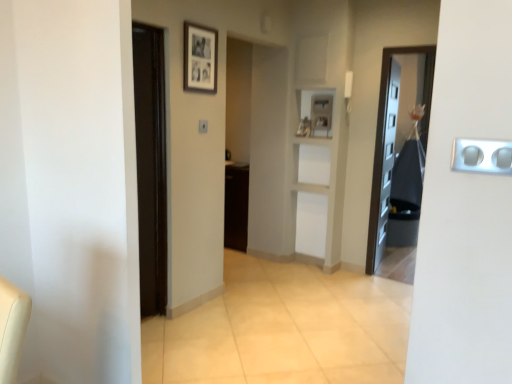
Question: Is black fabric bag at right taller than silver metallic outlet at right?

Choices:
 (A) yes
 (B) no

Answer: (A)

Question: Is black fabric bag at right thinner than silver metallic outlet at right?

Choices:
 (A) no
 (B) yes

Answer: (A)

Question: Could you tell me if black fabric bag at right is turned towards silver metallic outlet at right?

Choices:
 (A) yes
 (B) no

Answer: (B)

Question: Is black fabric bag at right wider than silver metallic outlet at right?

Choices:
 (A) yes
 (B) no

Answer: (A)

Question: From the image's perspective, is black fabric bag at right located beneath silver metallic outlet at right?

Choices:
 (A) no
 (B) yes

Answer: (A)

Question: Is black fabric bag at right facing away from silver metallic outlet at right?

Choices:
 (A) no
 (B) yes

Answer: (A)

Question: From the image's perspective, is black matte picture frame at upper center over black fabric bag at right?

Choices:
 (A) no
 (B) yes

Answer: (B)

Question: Is the position of black matte picture frame at upper center more distant than that of black fabric bag at right?

Choices:
 (A) no
 (B) yes

Answer: (A)

Question: Is black matte picture frame at upper center positioned in front of black fabric bag at right?

Choices:
 (A) yes
 (B) no

Answer: (A)

Question: Is black matte picture frame at upper center thinner than black fabric bag at right?

Choices:
 (A) yes
 (B) no

Answer: (A)

Question: Can you confirm if black matte picture frame at upper center is taller than black fabric bag at right?

Choices:
 (A) yes
 (B) no

Answer: (B)

Question: Is black matte picture frame at upper center shorter than black fabric bag at right?

Choices:
 (A) yes
 (B) no

Answer: (A)

Question: Is silver metallic outlet at right touching black fabric bag at right?

Choices:
 (A) yes
 (B) no

Answer: (B)